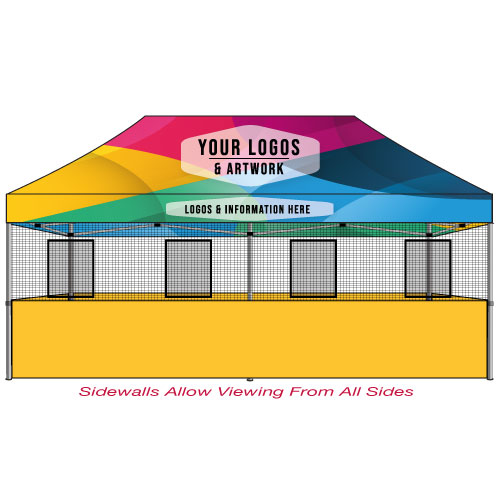
The height and width of the screenshot is (500, 500). What are the coordinates of `painting frames` in the screenshot? It's located at (85, 255), (193, 271), (300, 260), (416, 264).